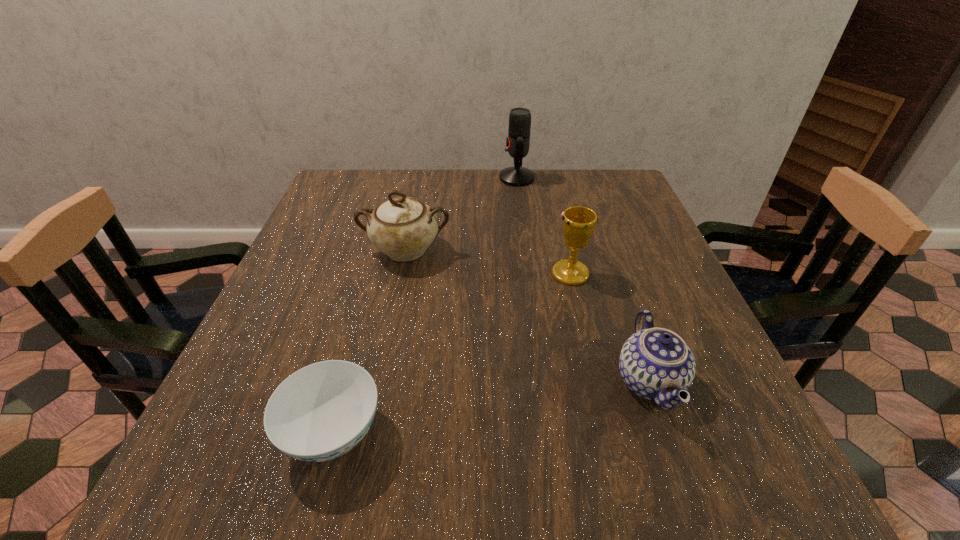
Identify the location of free space between the farthest chinaware and the shortest object. (370, 342).

Where is `unoccupied position between the farthest object and the chalice`? Image resolution: width=960 pixels, height=540 pixels. unoccupied position between the farthest object and the chalice is located at coordinates (543, 226).

In order to click on vacant space in between the shortest object and the chalice in this screenshot , I will do `click(452, 353)`.

Locate an element on the screen. The height and width of the screenshot is (540, 960). free space between the tallest object and the shortest chinaware is located at coordinates (425, 306).

Where is `vacant area between the tallest chinaware and the tallest object`? The image size is (960, 540). vacant area between the tallest chinaware and the tallest object is located at coordinates (461, 214).

Locate which object is the fourth closest to the tallest object. Please provide its 2D coordinates. Your answer should be formatted as a tuple, i.e. [(x, y)], where the tuple contains the x and y coordinates of a point satisfying the conditions above.

[(322, 411)]

Identify the location of object that stands as the closest to the shortest object. (403, 227).

Find the location of a particular element. The height and width of the screenshot is (540, 960). chinaware that can be found as the second closest to the farthest object is located at coordinates (655, 363).

Choose which chinaware is the second nearest neighbor to the second shortest chinaware. Please provide its 2D coordinates. Your answer should be formatted as a tuple, i.e. [(x, y)], where the tuple contains the x and y coordinates of a point satisfying the conditions above.

[(322, 411)]

Find the location of `vacant space that satisfies the following two spatial constraints: 1. on the side of the chalice with the red ring; 2. on the right side of the farthest object`. vacant space that satisfies the following two spatial constraints: 1. on the side of the chalice with the red ring; 2. on the right side of the farthest object is located at coordinates click(529, 274).